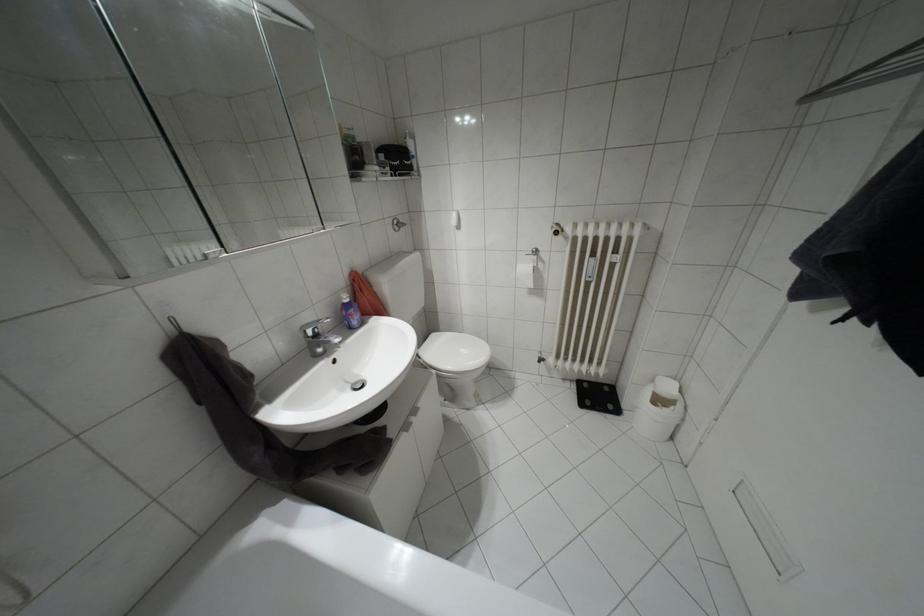
Which object does [351,315] point to?

It corresponds to the purple soap bottle in the image.